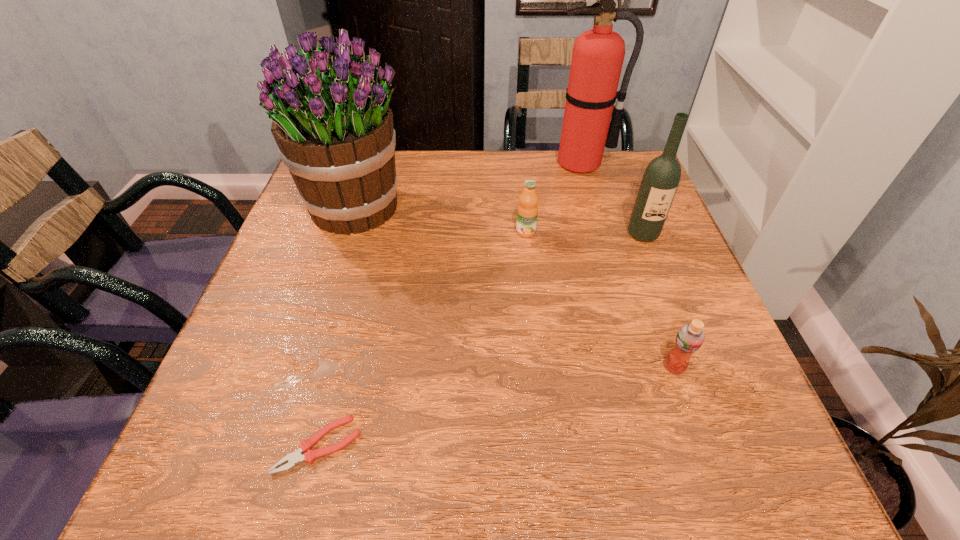
Locate an element on the screen. This screenshot has height=540, width=960. empty space between the right orange juice and the bouquet is located at coordinates (516, 287).

Find the location of a particular element. empty space between the fire extinguisher and the right orange juice is located at coordinates (628, 265).

Locate an element on the screen. This screenshot has height=540, width=960. empty space that is in between the third object from left to right and the bouquet is located at coordinates (442, 220).

Image resolution: width=960 pixels, height=540 pixels. Find the location of `vacant point located between the right orange juice and the pliers`. vacant point located between the right orange juice and the pliers is located at coordinates (496, 406).

The height and width of the screenshot is (540, 960). Find the location of `free space between the fourth object from right to left and the shortest object`. free space between the fourth object from right to left and the shortest object is located at coordinates (422, 339).

You are a GUI agent. You are given a task and a screenshot of the screen. Output one action in this format:
    pyautogui.click(x=<x>, y=<y>)
    Task: Click on the free space between the left orange juice and the right orange juice
    
    Given the screenshot: What is the action you would take?
    pyautogui.click(x=600, y=299)

Identify the location of vacant area between the farthest object and the wine bottle. The height and width of the screenshot is (540, 960). (612, 199).

The image size is (960, 540). I want to click on free spot between the bouquet and the fire extinguisher, so click(x=469, y=186).

At what (x,y) coordinates should I click in order to perform the action: click on vacant space in between the farther orange juice and the fourth shortest object. Please return your answer as a coordinate pair (x, y). Image resolution: width=960 pixels, height=540 pixels. Looking at the image, I should click on (585, 233).

At what (x,y) coordinates should I click in order to perform the action: click on free point between the pliers and the farthest object. Please return your answer as a coordinate pair (x, y). This screenshot has width=960, height=540. Looking at the image, I should click on (449, 304).